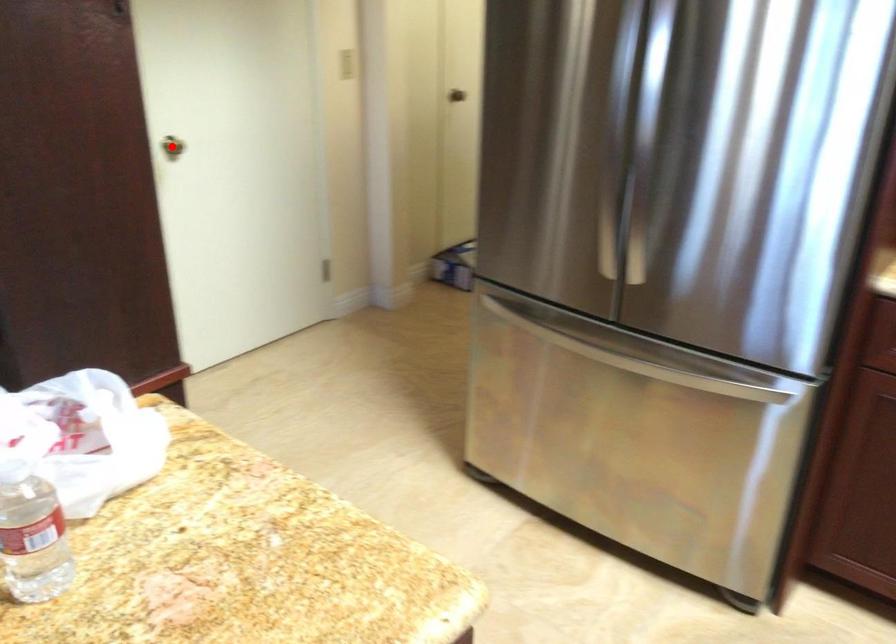
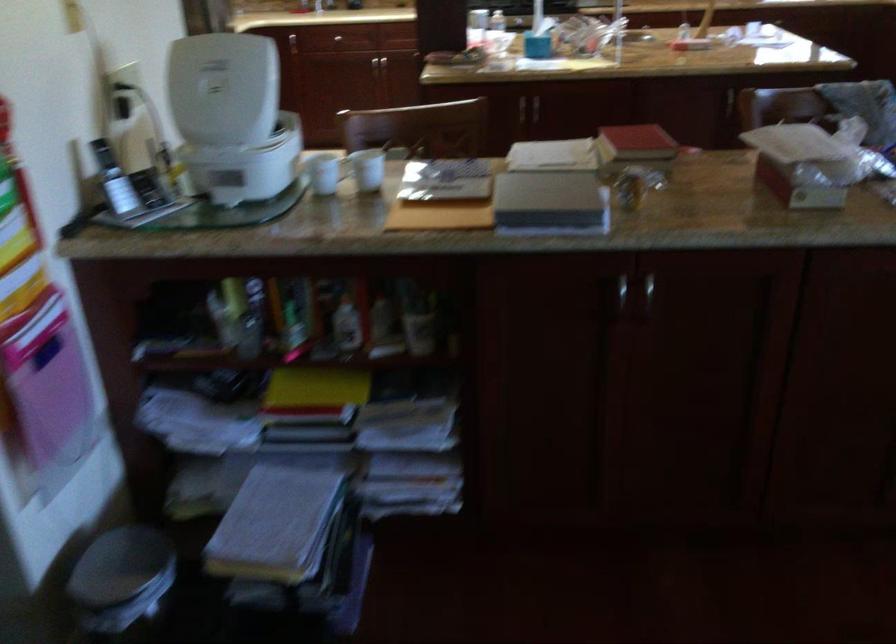
Question: I am providing you with two images of the same scene from different viewpoints. A red point is marked on the first image. Can you still see the location of the red point in image 2?

Choices:
 (A) Yes
 (B) No

Answer: (B)